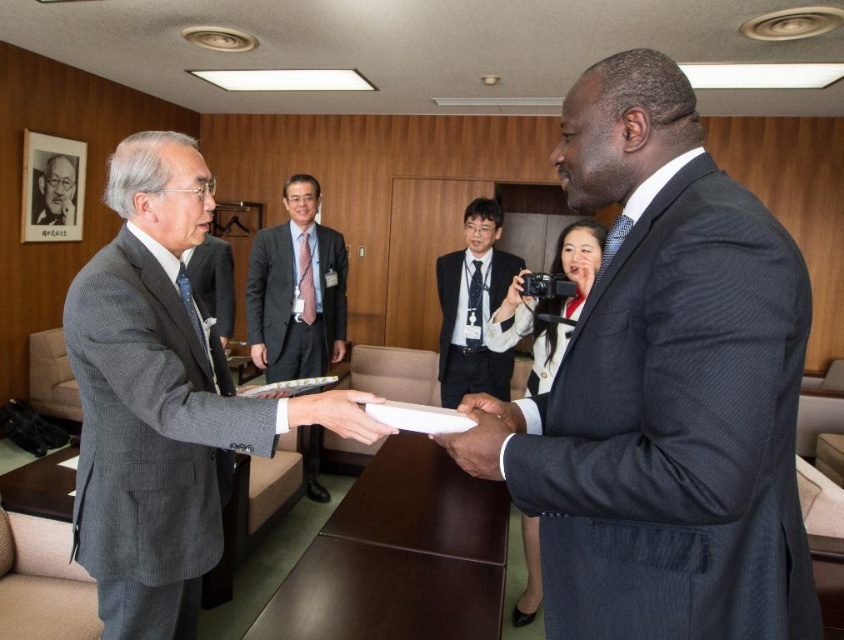
You are organizing a photo shoot in the conference room and need to position the matte gray suit at center and the matte black camera at center. Since you have limited space, can you determine which object takes up more horizontal space?

The matte gray suit at center has a larger width than the matte black camera at center, so it occupies more horizontal space and requires more room.

You are an interior designer observing the meeting scene. You need to place a decorative item between the gray wool suit at left and the dark brown leather hand at center. Which object should you place closer to the smaller one to maintain balance?

The dark brown leather hand at center is smaller in size compared to the gray wool suit at left. To maintain balance, place the decorative item closer to the dark brown leather hand at center so it can counterbalance the larger object.

You are a photographer in a conference room setting. You see a matte black camera at center and a dark brown leather hand at center. Which object is positioned to the right of the other?

The matte black camera at center is to the right of the dark brown leather hand at center.